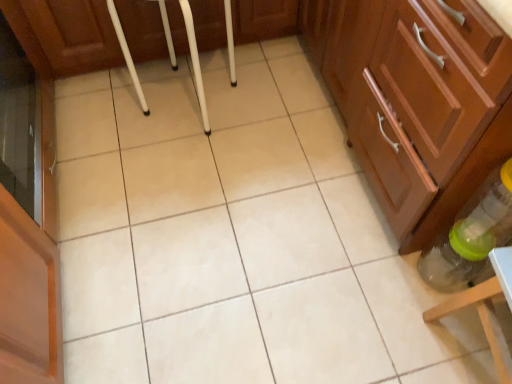
Where is `matte wood cabinet at center-right, which ranks as the second cabinetry in top-to-bottom order`? The image size is (512, 384). matte wood cabinet at center-right, which ranks as the second cabinetry in top-to-bottom order is located at coordinates (422, 87).

Where is `translucent plastic bottle at lower right`? The image size is (512, 384). translucent plastic bottle at lower right is located at coordinates (471, 235).

The image size is (512, 384). Find the location of `white plastic bar stool at center`. white plastic bar stool at center is located at coordinates (195, 62).

The height and width of the screenshot is (384, 512). I want to click on matte wood cabinet at center-right, the 1th cabinetry positioned from the bottom, so click(x=422, y=87).

Considering the sizes of objects wooden cabinet at center, arranged as the first cabinetry when viewed from the top, and white plastic bar stool at center in the image provided, who is thinner, wooden cabinet at center, arranged as the first cabinetry when viewed from the top, or white plastic bar stool at center?

white plastic bar stool at center is thinner.

Considering the positions of points (264, 12) and (192, 57), is point (264, 12) closer to camera compared to point (192, 57)?

No, it is behind (192, 57).

Can you see wooden cabinet at center, which appears as the second cabinetry when ordered from the bottom, touching white plastic bar stool at center?

No.

Can you tell me how much wooden cabinet at center, arranged as the first cabinetry when viewed from the top, and white plastic bar stool at center differ in facing direction?

0.279 degrees.

Is translucent plastic bottle at lower right positioned with its back to white plastic bar stool at center?

translucent plastic bottle at lower right does not have its back to white plastic bar stool at center.

Where is `bar stool behind the translucent plastic bottle at lower right`? Image resolution: width=512 pixels, height=384 pixels. bar stool behind the translucent plastic bottle at lower right is located at coordinates (195, 62).

Does point (505, 217) come in front of point (135, 77)?

Yes, point (505, 217) is closer to viewer.

Is translucent plastic bottle at lower right inside the boundaries of white plastic bar stool at center, or outside?

translucent plastic bottle at lower right is located beyond the bounds of white plastic bar stool at center.

Which object is positioned more to the right, wooden cabinet at center, arranged as the first cabinetry when viewed from the top, or translucent plastic bottle at lower right?

translucent plastic bottle at lower right.

Considering the points (91, 38) and (455, 264), which point is in front, point (91, 38) or point (455, 264)?

The point (455, 264) is closer.

Is wooden cabinet at center, arranged as the first cabinetry when viewed from the top, next to translucent plastic bottle at lower right and touching it?

No, wooden cabinet at center, arranged as the first cabinetry when viewed from the top, is not making contact with translucent plastic bottle at lower right.

Is matte wood cabinet at center-right, the 1th cabinetry positioned from the bottom, next to white plastic bar stool at center and touching it?

No, matte wood cabinet at center-right, the 1th cabinetry positioned from the bottom, is not touching white plastic bar stool at center.

Locate an element on the screen. bar stool above the matte wood cabinet at center-right, which ranks as the second cabinetry in top-to-bottom order (from the image's perspective) is located at coordinates (195, 62).

Is point (343, 48) less distant than point (113, 6)?

Yes, point (343, 48) is in front of point (113, 6).

Considering the positions of objects matte wood cabinet at center-right, the 1th cabinetry positioned from the bottom, and white plastic bar stool at center in the image provided, who is more to the right, matte wood cabinet at center-right, the 1th cabinetry positioned from the bottom, or white plastic bar stool at center?

From the viewer's perspective, matte wood cabinet at center-right, the 1th cabinetry positioned from the bottom, appears more on the right side.

Is translucent plastic bottle at lower right looking in the opposite direction of matte wood cabinet at center-right, the 1th cabinetry positioned from the bottom?

That's not correct — translucent plastic bottle at lower right is not looking away from matte wood cabinet at center-right, the 1th cabinetry positioned from the bottom.

Is translucent plastic bottle at lower right positioned behind matte wood cabinet at center-right, which ranks as the second cabinetry in top-to-bottom order?

No, translucent plastic bottle at lower right is in front of matte wood cabinet at center-right, which ranks as the second cabinetry in top-to-bottom order.

Where is `bottle above the matte wood cabinet at center-right, which ranks as the second cabinetry in top-to-bottom order (from a real-world perspective)`? This screenshot has width=512, height=384. bottle above the matte wood cabinet at center-right, which ranks as the second cabinetry in top-to-bottom order (from a real-world perspective) is located at coordinates (471, 235).

From a real-world perspective, is matte wood cabinet at center-right, the 1th cabinetry positioned from the bottom, on translucent plastic bottle at lower right?

No, from a real-world perspective, matte wood cabinet at center-right, the 1th cabinetry positioned from the bottom, is not above translucent plastic bottle at lower right.

Considering the sizes of objects matte wood cabinet at center-right, which ranks as the second cabinetry in top-to-bottom order, and translucent plastic bottle at lower right in the image provided, who is taller, matte wood cabinet at center-right, which ranks as the second cabinetry in top-to-bottom order, or translucent plastic bottle at lower right?

Standing taller between the two is translucent plastic bottle at lower right.

Is white plastic bar stool at center shorter than translucent plastic bottle at lower right?

Incorrect, the height of white plastic bar stool at center does not fall short of that of translucent plastic bottle at lower right.

Locate an element on the screen. The image size is (512, 384). bar stool below the translucent plastic bottle at lower right (from a real-world perspective) is located at coordinates (195, 62).

From the image's perspective, is white plastic bar stool at center on translucent plastic bottle at lower right?

Correct, white plastic bar stool at center appears higher than translucent plastic bottle at lower right in the image.

Relative to translucent plastic bottle at lower right, is white plastic bar stool at center in front or behind?

white plastic bar stool at center is positioned farther from the viewer than translucent plastic bottle at lower right.

Locate an element on the screen. Image resolution: width=512 pixels, height=384 pixels. bar stool below the wooden cabinet at center, arranged as the first cabinetry when viewed from the top (from the image's perspective) is located at coordinates (195, 62).

At what (x,y) coordinates should I click in order to perform the action: click on bottle on the right of white plastic bar stool at center. Please return your answer as a coordinate pair (x, y). This screenshot has height=384, width=512. Looking at the image, I should click on (471, 235).

Considering their positions, is white plastic bar stool at center positioned closer to wooden cabinet at center, which appears as the second cabinetry when ordered from the bottom, than translucent plastic bottle at lower right?

white plastic bar stool at center is positioned closer to the anchor wooden cabinet at center, which appears as the second cabinetry when ordered from the bottom.

Looking at this image, considering their positions, is white plastic bar stool at center positioned further to translucent plastic bottle at lower right than wooden cabinet at center, which appears as the second cabinetry when ordered from the bottom?

wooden cabinet at center, which appears as the second cabinetry when ordered from the bottom, is positioned further to the anchor translucent plastic bottle at lower right.

From the image, which object appears to be nearer to white plastic bar stool at center, translucent plastic bottle at lower right or matte wood cabinet at center-right, the 1th cabinetry positioned from the bottom?

The object closer to white plastic bar stool at center is matte wood cabinet at center-right, the 1th cabinetry positioned from the bottom.

When comparing their distances from translucent plastic bottle at lower right, does white plastic bar stool at center or matte wood cabinet at center-right, which ranks as the second cabinetry in top-to-bottom order, seem closer?

matte wood cabinet at center-right, which ranks as the second cabinetry in top-to-bottom order.

Looking at the image, which one is located further to matte wood cabinet at center-right, the 1th cabinetry positioned from the bottom, wooden cabinet at center, which appears as the second cabinetry when ordered from the bottom, or white plastic bar stool at center?

white plastic bar stool at center is further to matte wood cabinet at center-right, the 1th cabinetry positioned from the bottom.

Based on their spatial positions, is white plastic bar stool at center or wooden cabinet at center, which appears as the second cabinetry when ordered from the bottom, closer to matte wood cabinet at center-right, the 1th cabinetry positioned from the bottom?

The object closer to matte wood cabinet at center-right, the 1th cabinetry positioned from the bottom, is wooden cabinet at center, which appears as the second cabinetry when ordered from the bottom.

Looking at the image, which one is located closer to wooden cabinet at center, which appears as the second cabinetry when ordered from the bottom, white plastic bar stool at center or matte wood cabinet at center-right, which ranks as the second cabinetry in top-to-bottom order?

Based on the image, white plastic bar stool at center appears to be nearer to wooden cabinet at center, which appears as the second cabinetry when ordered from the bottom.

Considering their positions, is wooden cabinet at center, which appears as the second cabinetry when ordered from the bottom, positioned closer to white plastic bar stool at center than matte wood cabinet at center-right, which ranks as the second cabinetry in top-to-bottom order?

wooden cabinet at center, which appears as the second cabinetry when ordered from the bottom, is positioned closer to the anchor white plastic bar stool at center.

Identify the location of cabinetry between white plastic bar stool at center and translucent plastic bottle at lower right from left to right. The height and width of the screenshot is (384, 512). (422, 87).

Where is `bar stool situated between wooden cabinet at center, which appears as the second cabinetry when ordered from the bottom, and translucent plastic bottle at lower right from left to right`? The height and width of the screenshot is (384, 512). bar stool situated between wooden cabinet at center, which appears as the second cabinetry when ordered from the bottom, and translucent plastic bottle at lower right from left to right is located at coordinates (195, 62).

Where is `cabinetry between wooden cabinet at center, which appears as the second cabinetry when ordered from the bottom, and translucent plastic bottle at lower right in the up-down direction`? This screenshot has height=384, width=512. cabinetry between wooden cabinet at center, which appears as the second cabinetry when ordered from the bottom, and translucent plastic bottle at lower right in the up-down direction is located at coordinates (422, 87).

Where is `bar stool between wooden cabinet at center, arranged as the first cabinetry when viewed from the top, and matte wood cabinet at center-right, the 1th cabinetry positioned from the bottom, in the up-down direction`? This screenshot has height=384, width=512. bar stool between wooden cabinet at center, arranged as the first cabinetry when viewed from the top, and matte wood cabinet at center-right, the 1th cabinetry positioned from the bottom, in the up-down direction is located at coordinates (195, 62).